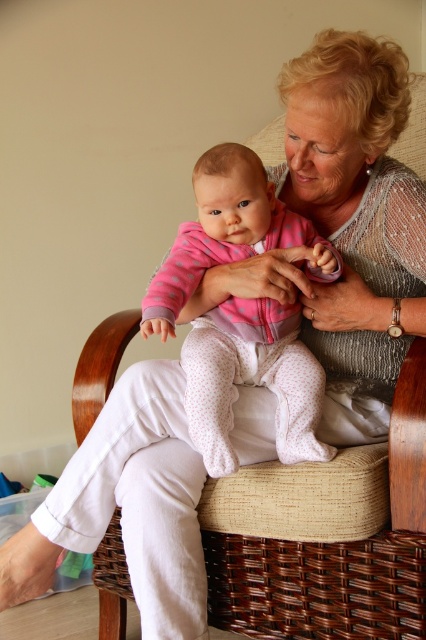
Does woven brown chair at center appear on the right side of pink fleece onesie at center?

No, woven brown chair at center is not to the right of pink fleece onesie at center.

Does woven brown chair at center appear over pink fleece onesie at center?

Actually, woven brown chair at center is below pink fleece onesie at center.

Does point (397, 456) lie in front of point (233, 317)?

Yes, it is.

The image size is (426, 640). Identify the location of woven brown chair at center. (325, 536).